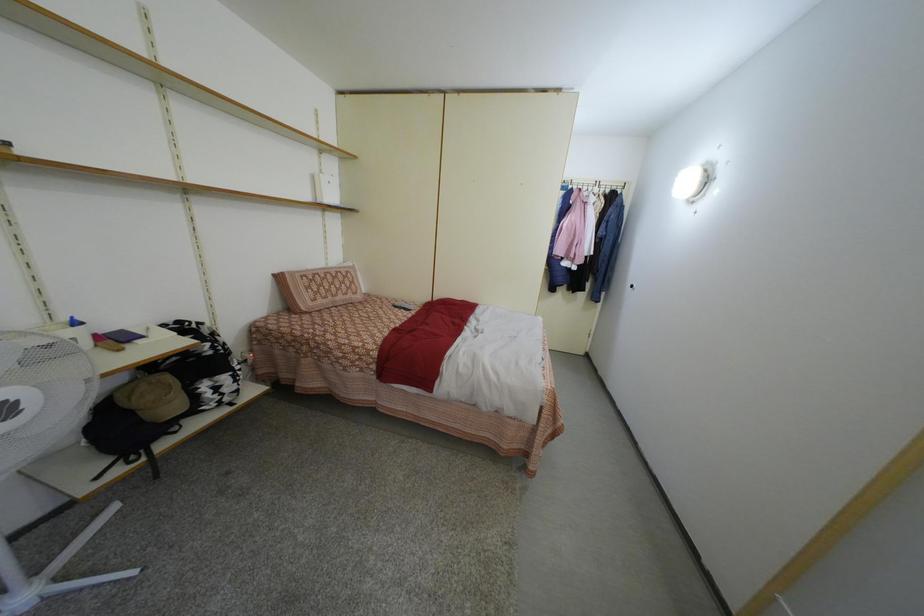
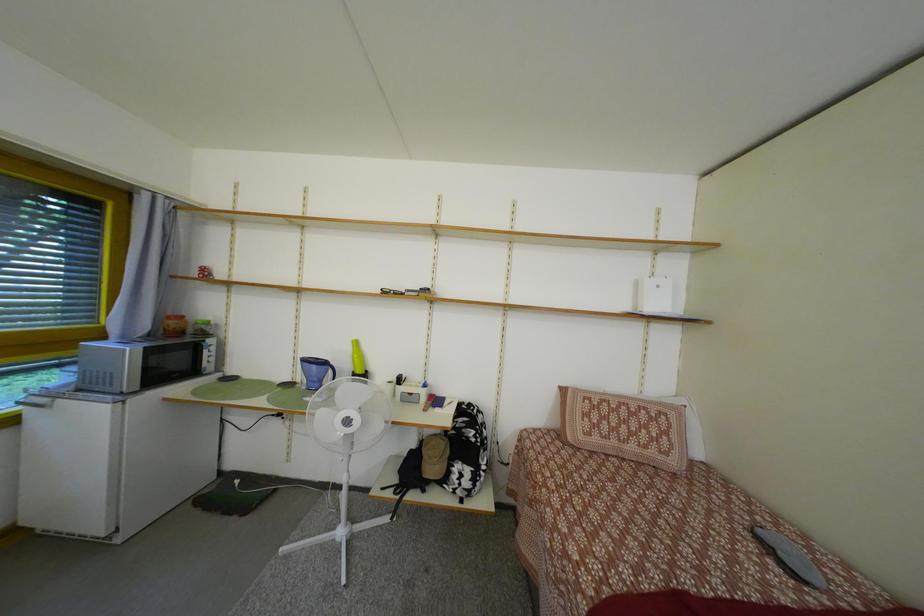
Question: The first image is from the beginning of the video and the second image is from the end. How did the camera likely rotate when shooting the video?

Choices:
 (A) Left
 (B) Right
 (C) Up
 (D) Down

Answer: (A)